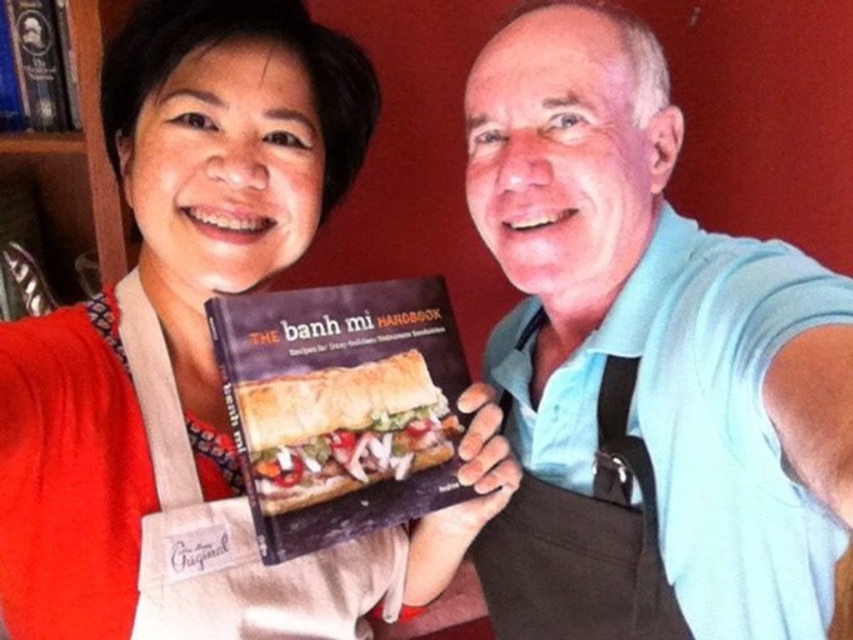
Is matte black book at center positioned behind brown fabric apron at center?

No, matte black book at center is closer to the viewer.

Can you confirm if matte black book at center is positioned to the right of brown fabric apron at center?

In fact, matte black book at center is to the left of brown fabric apron at center.

Who is more distant from viewer, (451, 467) or (538, 525)?

The point (538, 525) is more distant.

At what (x,y) coordinates should I click in order to perform the action: click on matte black book at center. Please return your answer as a coordinate pair (x, y). Looking at the image, I should click on tap(341, 406).

Looking at this image, does golden brown bread at center appear under wooden bookshelf at upper left?

Yes, golden brown bread at center is below wooden bookshelf at upper left.

Is golden brown bread at center further to camera compared to wooden bookshelf at upper left?

No.

Who is more forward, (292, 445) or (16, 170)?

Point (292, 445) is more forward.

This screenshot has height=640, width=853. In order to click on golden brown bread at center in this screenshot , I will do `click(352, 435)`.

Does wooden bookshelf at upper left appear on the left side of hardcover book at upper left?

Incorrect, wooden bookshelf at upper left is not on the left side of hardcover book at upper left.

Which is in front, point (9, 172) or point (67, 92)?

Point (67, 92) is more forward.

Who is more distant from viewer, (25, 157) or (36, 108)?

Positioned behind is point (25, 157).

The width and height of the screenshot is (853, 640). I want to click on wooden bookshelf at upper left, so [64, 186].